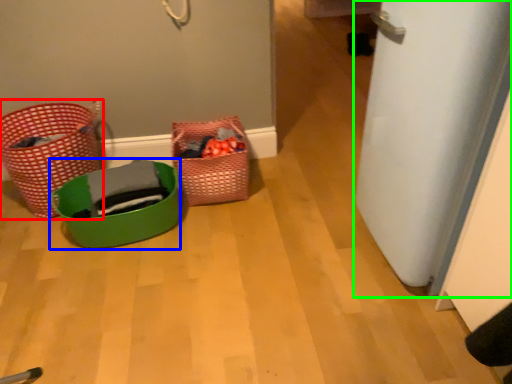
Question: Considering the real-world distances, which object is farthest from basket (highlighted by a red box)? basket (highlighted by a blue box) or door (highlighted by a green box)?

Choices:
 (A) basket
 (B) door

Answer: (B)